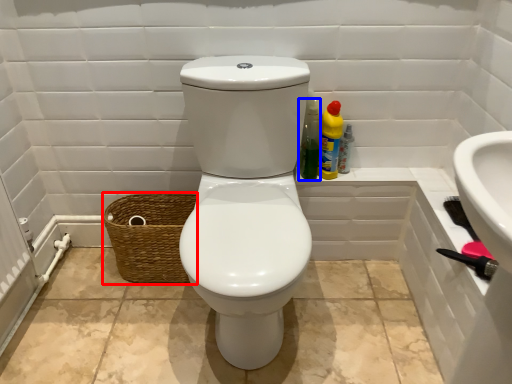
Question: Which object is closer to the camera taking this photo, basket (highlighted by a red box) or cleaning product (highlighted by a blue box)?

Choices:
 (A) basket
 (B) cleaning product

Answer: (B)